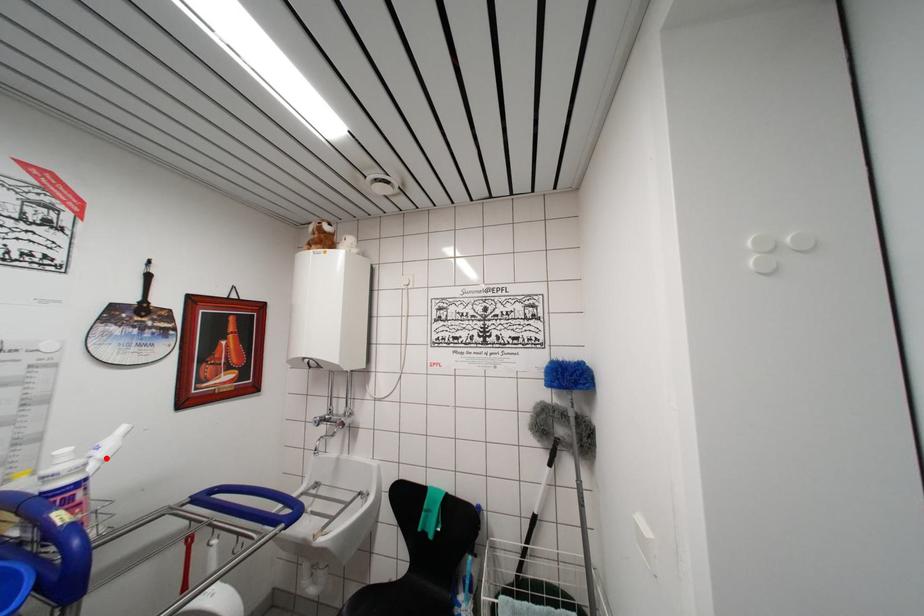
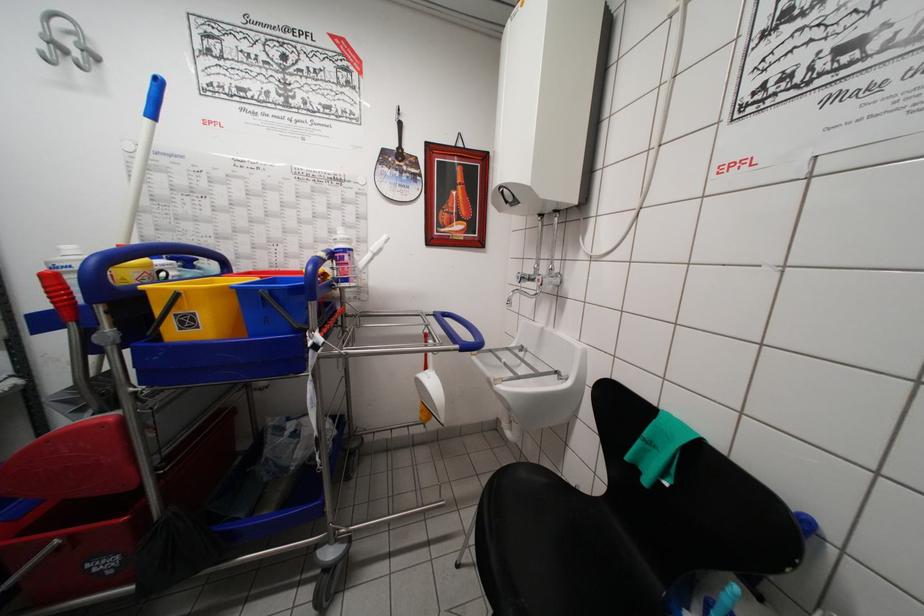
The point at the highlighted location is marked in the first image. Where is the corresponding point in the second image?

(377, 253)